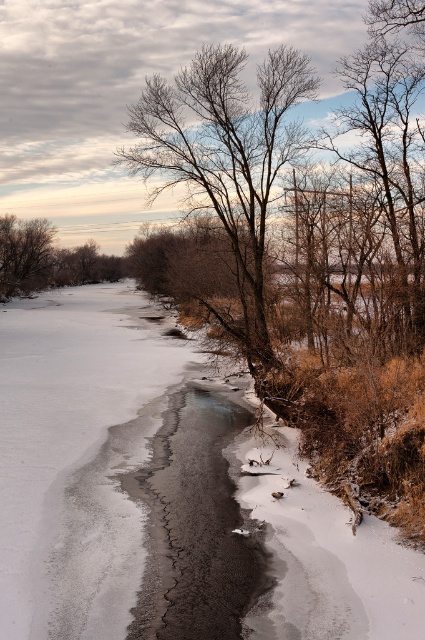
Does bare branches at center appear on the right side of brown matte tree at left?

Yes, bare branches at center is to the right of brown matte tree at left.

Is point (226, 122) farther from camera compared to point (5, 237)?

No, it is in front of (5, 237).

The image size is (425, 640). In order to click on bare branches at center in this screenshot , I will do `click(224, 170)`.

At what (x,y) coordinates should I click in order to perform the action: click on bare branches at center. Please return your answer as a coordinate pair (x, y). The image size is (425, 640). Looking at the image, I should click on (224, 170).